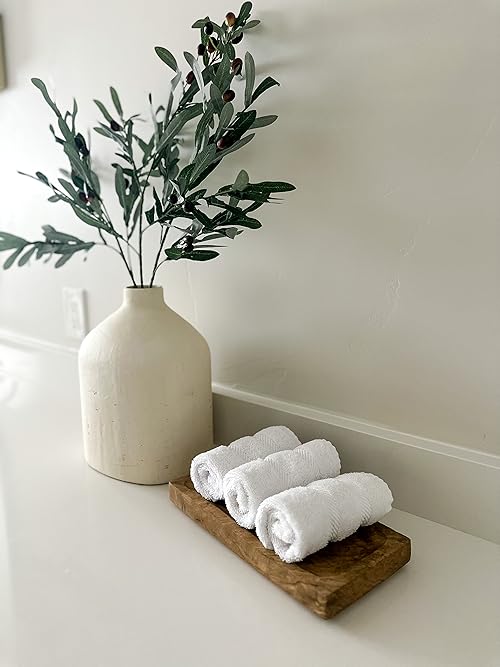
I want to click on plant shadows, so click(322, 153).